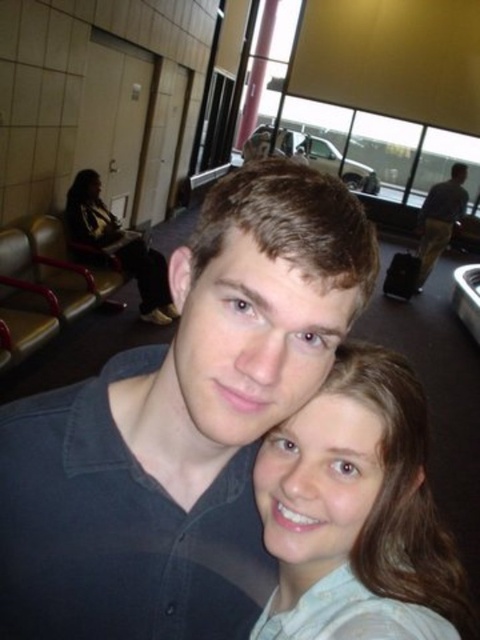
Question: Based on their relative distances, which object is nearer to the matte black jacket at left?

Choices:
 (A) smooth beige shirt at center
 (B) dark blue shirt at center
 (C) dark blue shirt at right

Answer: (C)

Question: Which of the following is the farthest from the observer?

Choices:
 (A) smooth beige shirt at center
 (B) matte black jacket at left
 (C) dark blue shirt at right
 (D) dark blue shirt at center

Answer: (C)

Question: Is dark blue shirt at center to the right of matte black jacket at left from the viewer's perspective?

Choices:
 (A) no
 (B) yes

Answer: (B)

Question: Which point is farther from the camera taking this photo?

Choices:
 (A) (290, 392)
 (B) (388, 538)
 (C) (159, 276)
 (D) (462, 214)

Answer: (D)

Question: Can you confirm if matte black jacket at left is smaller than dark blue shirt at right?

Choices:
 (A) no
 (B) yes

Answer: (B)

Question: Is dark blue shirt at center closer to camera compared to dark blue shirt at right?

Choices:
 (A) yes
 (B) no

Answer: (A)